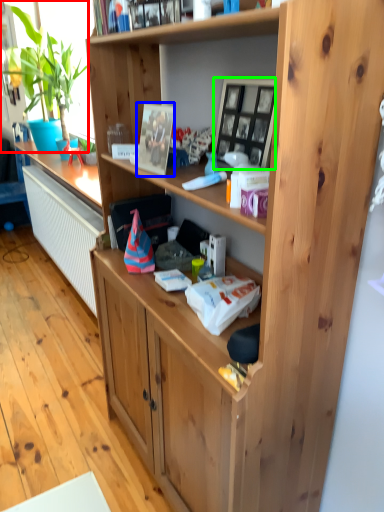
Question: Which object is the closest to the houseplant (highlighted by a red box)? Choose among these: picture frame (highlighted by a blue box) or picture frame (highlighted by a green box).

Choices:
 (A) picture frame
 (B) picture frame

Answer: (A)